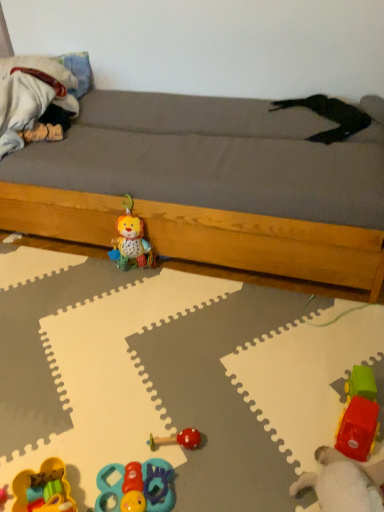
The width and height of the screenshot is (384, 512). I want to click on vacant space in front of smooth plastic rattle at center, the 3th toy viewed from the right, so 202,481.